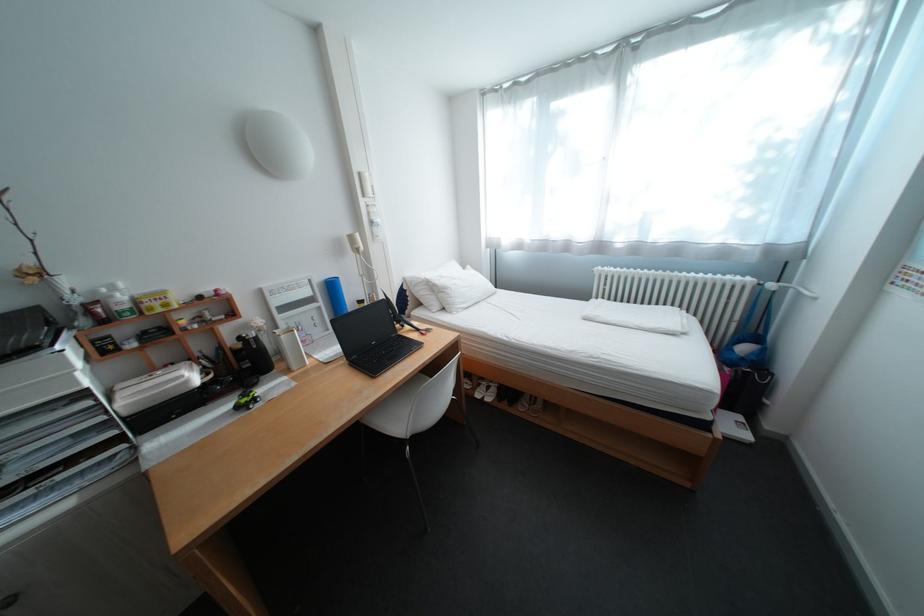
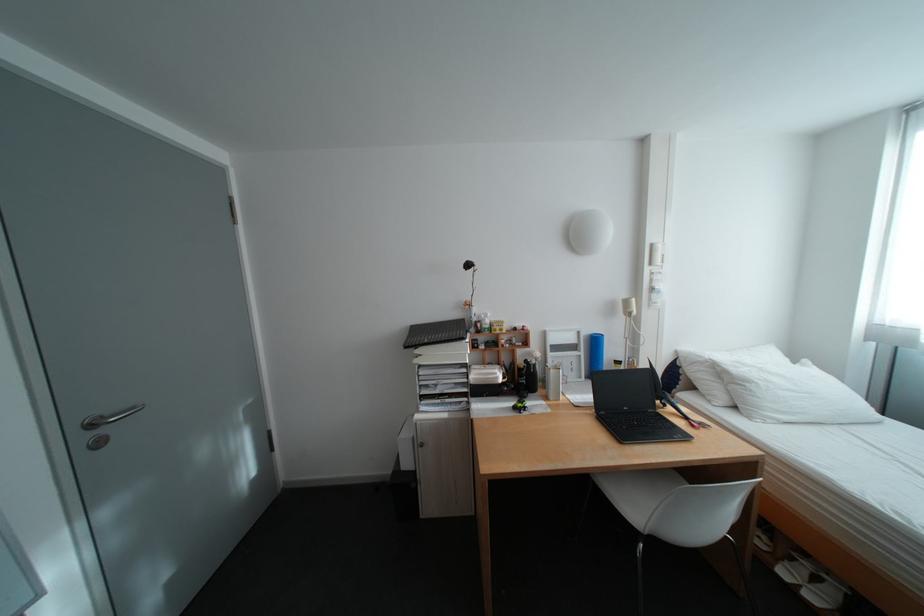
Find the pixel in the second image that matches the point at 334,304 in the first image.

(594, 354)